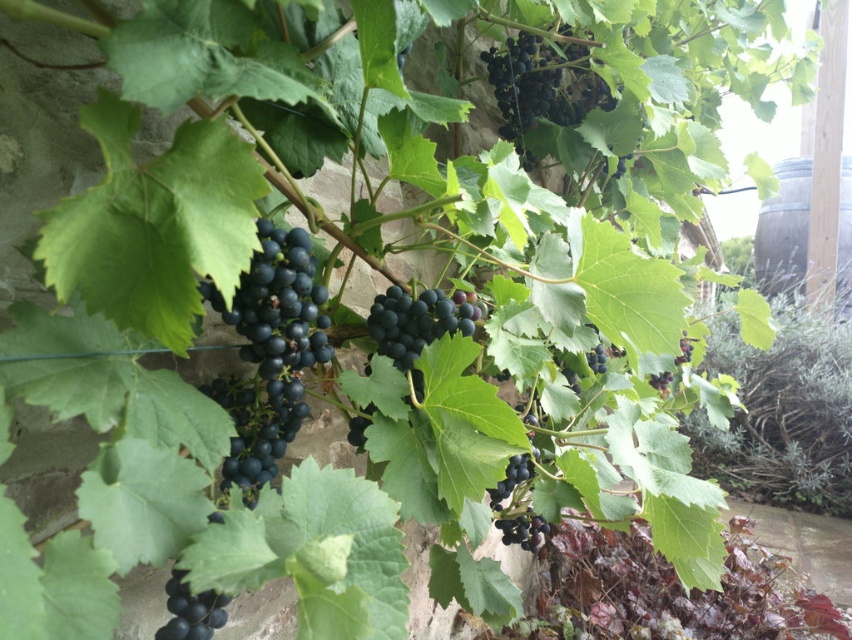
You are standing in front of a grapevine with dark purple grapes at center. A point is marked at coordinate (269, 353). What does this point most likely represent?

The point at coordinate (269, 353) most likely represents the location of the dark purple grapes at center.

You are a fruit picker observing the dark purple grapes at upper center and the black matte grapes at lower left in the vineyard. Which cluster is positioned higher up?

The dark purple grapes at upper center is positioned higher up as it is much taller than the black matte grapes at lower left.